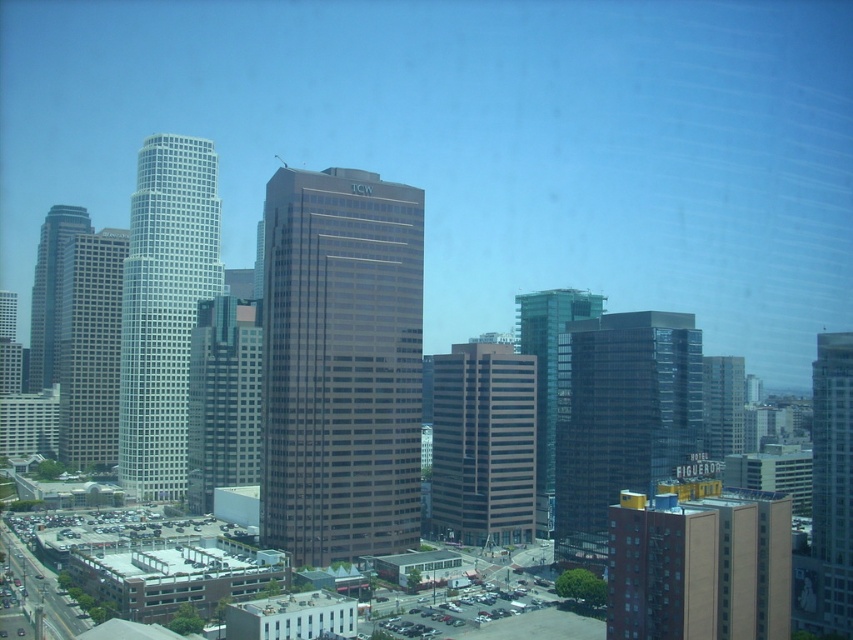
Question: Estimate the real-world distances between objects in this image. Which object is closer to the matte glass skyscraper at left?

Choices:
 (A) white glass skyscraper at left
 (B) white glass skyscraper at center-right

Answer: (A)

Question: Which point is farther from the camera taking this photo?

Choices:
 (A) (822, 346)
 (B) (717, 419)
 (C) (456, 538)
 (D) (740, 621)

Answer: (B)

Question: From the image, what is the correct spatial relationship of glassy reflective skyscraper at center-right in relation to glassy reflective skyscraper at center-left?

Choices:
 (A) right
 (B) left

Answer: (A)

Question: Can you confirm if white glass skyscraper at center-left is positioned below transparent glass skyscraper at center?

Choices:
 (A) yes
 (B) no

Answer: (B)

Question: Can you confirm if glassy reflective skyscraper at center-right is thinner than transparent glass skyscraper at center?

Choices:
 (A) no
 (B) yes

Answer: (A)

Question: Among these points, which one is nearest to the camera?

Choices:
 (A) (453, 428)
 (B) (834, 481)
 (C) (639, 525)

Answer: (C)